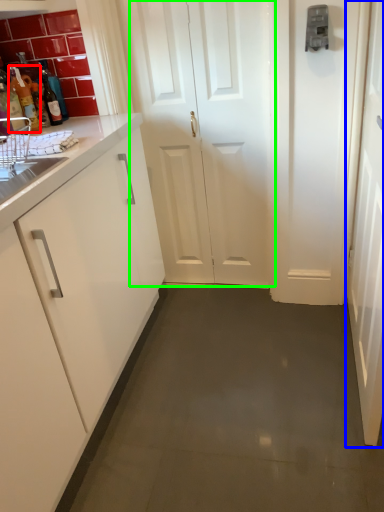
Question: Considering the real-world distances, which object is closest to bottle (highlighted by a red box)? door (highlighted by a blue box) or door (highlighted by a green box).

Choices:
 (A) door
 (B) door

Answer: (B)